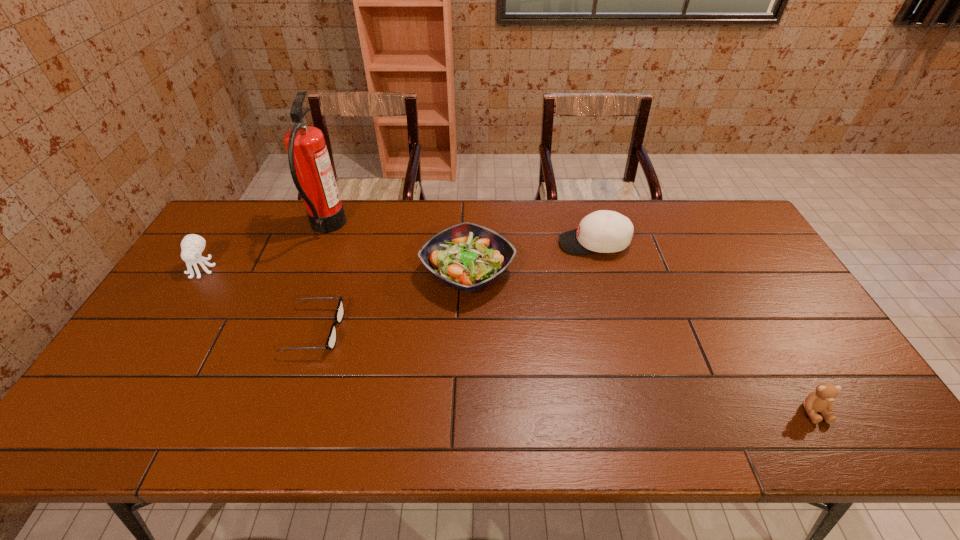
This screenshot has height=540, width=960. In order to click on object at the near right corner in this screenshot , I will do `click(821, 400)`.

This screenshot has width=960, height=540. I want to click on vacant space at the far edge of the desktop, so click(x=646, y=204).

Find the location of a particular element. The image size is (960, 540). free spot at the near edge of the desktop is located at coordinates (509, 441).

At what (x,y) coordinates should I click in order to perform the action: click on vacant space at the left edge of the desktop. Please return your answer as a coordinate pair (x, y). The width and height of the screenshot is (960, 540). Looking at the image, I should click on (217, 286).

Locate an element on the screen. vacant space at the right edge of the desktop is located at coordinates (766, 294).

Find the location of a particular element. Image resolution: width=960 pixels, height=540 pixels. vacant space at the far left corner of the desktop is located at coordinates (240, 241).

In the image, there is a desktop. Identify the location of vacant region at the far right corner. The width and height of the screenshot is (960, 540). (727, 205).

I want to click on empty space between the baseball cap and the salad plate, so click(531, 258).

The height and width of the screenshot is (540, 960). What are the coordinates of `unoccupied position between the shortest object and the fourth object from left to right` in the screenshot? It's located at (392, 301).

Where is `vacant area that lies between the baseball cap and the rightmost object`? This screenshot has height=540, width=960. vacant area that lies between the baseball cap and the rightmost object is located at coordinates (704, 327).